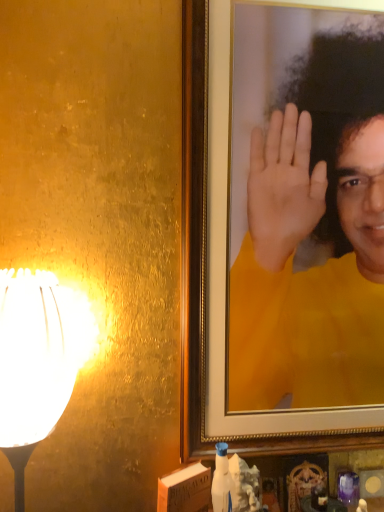
Question: Can you confirm if white glossy lampshade at left is positioned to the left of yellow matte portrait at upper right?

Choices:
 (A) no
 (B) yes

Answer: (B)

Question: Is white glossy lampshade at left taller than yellow matte portrait at upper right?

Choices:
 (A) no
 (B) yes

Answer: (A)

Question: Does white glossy lampshade at left have a larger size compared to yellow matte portrait at upper right?

Choices:
 (A) no
 (B) yes

Answer: (A)

Question: From the image's perspective, is white glossy lampshade at left below yellow matte portrait at upper right?

Choices:
 (A) yes
 (B) no

Answer: (A)

Question: Can you confirm if white glossy lampshade at left is wider than yellow matte portrait at upper right?

Choices:
 (A) yes
 (B) no

Answer: (A)

Question: Is white glossy lampshade at left touching yellow matte portrait at upper right?

Choices:
 (A) yes
 (B) no

Answer: (B)

Question: Can you confirm if yellow matte portrait at upper right is taller than white glossy lampshade at left?

Choices:
 (A) no
 (B) yes

Answer: (B)

Question: Can you confirm if yellow matte portrait at upper right is positioned to the right of white glossy lampshade at left?

Choices:
 (A) no
 (B) yes

Answer: (B)

Question: Can you confirm if yellow matte portrait at upper right is thinner than white glossy lampshade at left?

Choices:
 (A) no
 (B) yes

Answer: (B)

Question: Considering the relative sizes of yellow matte portrait at upper right and white glossy lampshade at left in the image provided, is yellow matte portrait at upper right wider than white glossy lampshade at left?

Choices:
 (A) no
 (B) yes

Answer: (A)

Question: Is yellow matte portrait at upper right far away from white glossy lampshade at left?

Choices:
 (A) yes
 (B) no

Answer: (B)

Question: From the image's perspective, is yellow matte portrait at upper right under white glossy lampshade at left?

Choices:
 (A) yes
 (B) no

Answer: (B)

Question: Choose the correct answer: Is white glossy lampshade at left inside yellow matte portrait at upper right or outside it?

Choices:
 (A) outside
 (B) inside

Answer: (A)